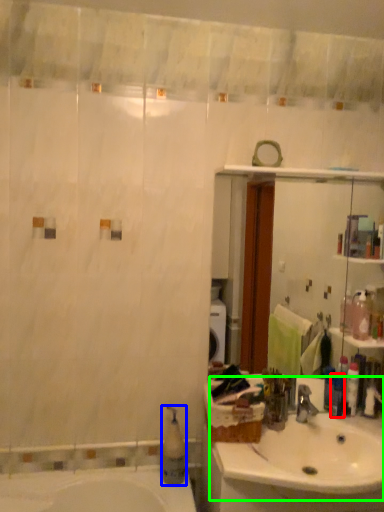
Question: Considering the real-world distances, which object is farthest from toiletry (highlighted by a red box)? soap dispenser (highlighted by a blue box) or sink (highlighted by a green box)?

Choices:
 (A) soap dispenser
 (B) sink

Answer: (A)